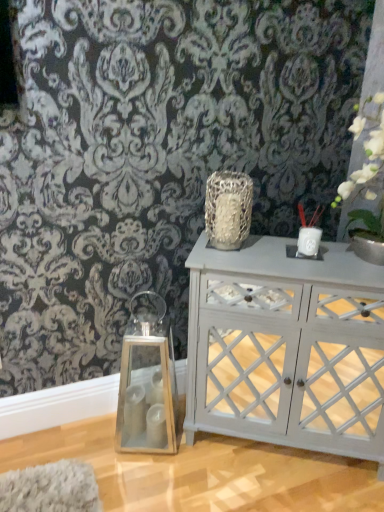
I want to click on vacant space underneath clear glass lantern at left, the third candle holder from the top (from a real-world perspective), so [x=144, y=449].